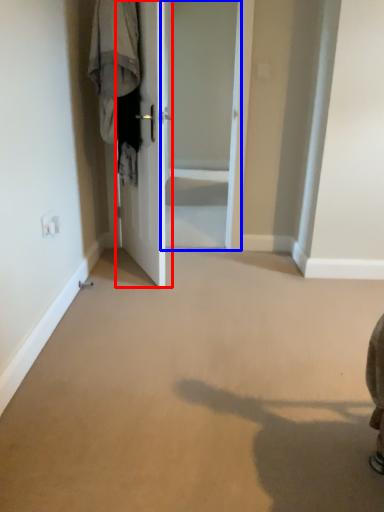
Question: Which object appears farthest to the camera in this image, door (highlighted by a red box) or screen door (highlighted by a blue box)?

Choices:
 (A) door
 (B) screen door

Answer: (B)